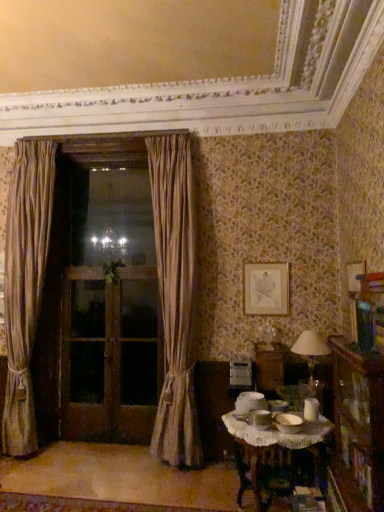
Question: From a real-world perspective, is brown wooden screen door at left, which is counted as the first screen door, starting from the left, positioned above or below brown wooden screen door at center, the 3th screen door from the left?

Choices:
 (A) above
 (B) below

Answer: (A)

Question: From the image's perspective, is brown wooden screen door at left, which ranks as the third screen door in right-to-left order, positioned above or below brown wooden screen door at center, the 3th screen door from the left?

Choices:
 (A) below
 (B) above

Answer: (A)

Question: Which object is positioned farthest from the silky beige curtain at center, which appears as the first curtain when viewed from the right?

Choices:
 (A) white lace tablecloth at lower right
 (B) brown wooden screen door at left, arranged as the 2th screen door when viewed from the left
 (C) matte silver picture frame at upper center
 (D) wooden bookcase at lower right
 (E) white fabric lampshade at right

Answer: (D)

Question: Which is nearer to the white lace tablecloth at lower right?

Choices:
 (A) white fabric lampshade at right
 (B) wooden bookcase at lower right
 (C) brown wooden screen door at center, the 3th screen door from the left
 (D) matte silver picture frame at upper center
 (E) silky beige curtain at left, marked as the 2th curtain in a right-to-left arrangement

Answer: (B)